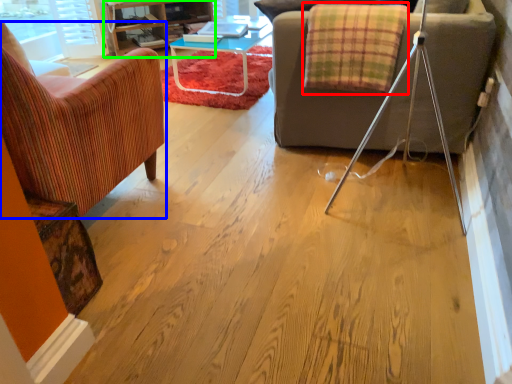
Question: Which is farther away from blanket (highlighted by a red box)? chair (highlighted by a blue box) or entertainment center (highlighted by a green box)?

Choices:
 (A) chair
 (B) entertainment center

Answer: (B)